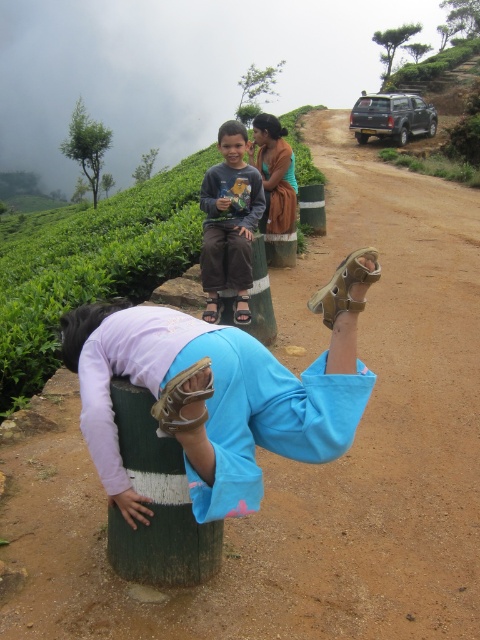
Question: Is blue fabric squat at center below brown textured dress at upper center?

Choices:
 (A) no
 (B) yes

Answer: (B)

Question: Which point is closer to the camera?

Choices:
 (A) (294, 168)
 (B) (144, 540)
 (C) (196, 365)
 (D) (247, 296)

Answer: (C)

Question: Does dark gray fabric shirt at center have a lesser width compared to brown textured dress at upper center?

Choices:
 (A) no
 (B) yes

Answer: (A)

Question: Is blue fabric squat at center positioned in front of green wood pole at lower center?

Choices:
 (A) yes
 (B) no

Answer: (A)

Question: Which of the following is the closest to the observer?

Choices:
 (A) (169, 465)
 (B) (268, 220)

Answer: (A)

Question: Among these objects, which one is farthest from the camera?

Choices:
 (A) green wood pole at lower center
 (B) dark gray fabric shirt at center
 (C) blue fabric squat at center
 (D) brown textured dress at upper center

Answer: (D)